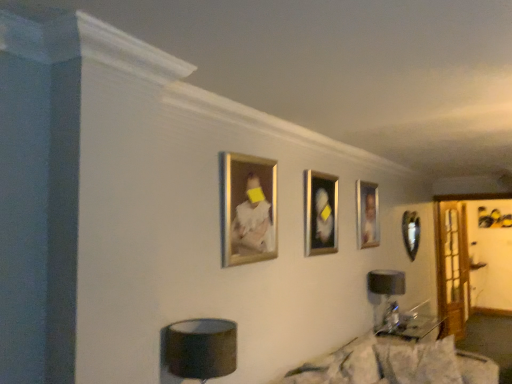
Question: Should I look upward or downward to see fluffy white pillow at lower center, which appears as the first pillow when viewed from the left?

Choices:
 (A) down
 (B) up

Answer: (A)

Question: Does matte black lampshade at lower center, the second table lamp in the back-to-front sequence, have a greater width compared to black fabric table lamp at lower right, the 2th table lamp when ordered from left to right?

Choices:
 (A) no
 (B) yes

Answer: (B)

Question: From the image's perspective, does matte black lampshade at lower center, the 1th table lamp positioned from the front, appear lower than black fabric table lamp at lower right, which is the 1th table lamp from back to front?

Choices:
 (A) yes
 (B) no

Answer: (B)

Question: Is matte black lampshade at lower center, which is counted as the second table lamp, starting from the right, looking in the opposite direction of black fabric table lamp at lower right, which ranks as the first table lamp in right-to-left order?

Choices:
 (A) no
 (B) yes

Answer: (A)

Question: From a real-world perspective, is matte black lampshade at lower center, the 1th table lamp positioned from the front, located beneath black fabric table lamp at lower right, marked as the 2th table lamp in a front-to-back arrangement?

Choices:
 (A) yes
 (B) no

Answer: (B)

Question: Is matte black lampshade at lower center, the second table lamp in the back-to-front sequence, positioned before black fabric table lamp at lower right, marked as the 2th table lamp in a front-to-back arrangement?

Choices:
 (A) yes
 (B) no

Answer: (A)

Question: Can you confirm if matte black lampshade at lower center, the second table lamp in the back-to-front sequence, is smaller than black fabric table lamp at lower right, marked as the 2th table lamp in a front-to-back arrangement?

Choices:
 (A) yes
 (B) no

Answer: (A)

Question: Does metallic silver picture frame at center, positioned as the 3th picture frame in right-to-left order, have a larger size compared to fluffy white pillow at lower center, which appears as the first pillow when viewed from the left?

Choices:
 (A) no
 (B) yes

Answer: (A)

Question: Can we say metallic silver picture frame at center, positioned as the 3th picture frame in right-to-left order, lies outside fluffy white pillow at lower center, the 2th pillow viewed from the right?

Choices:
 (A) no
 (B) yes

Answer: (B)

Question: Can you confirm if metallic silver picture frame at center, which appears as the second picture frame when viewed from the front, is smaller than fluffy white pillow at lower center, which appears as the first pillow when viewed from the left?

Choices:
 (A) yes
 (B) no

Answer: (A)

Question: From a real-world perspective, is metallic silver picture frame at center, which is counted as the 2th picture frame, starting from the left, physically below fluffy white pillow at lower center, the 2th pillow viewed from the right?

Choices:
 (A) no
 (B) yes

Answer: (A)

Question: Is metallic silver picture frame at center, marked as the 3th picture frame in a back-to-front arrangement, further to the viewer compared to fluffy white pillow at lower center, the 2th pillow viewed from the right?

Choices:
 (A) no
 (B) yes

Answer: (B)

Question: Considering the relative sizes of metallic silver picture frame at center, positioned as the 3th picture frame in right-to-left order, and fluffy white pillow at lower center, which appears as the first pillow when viewed from the left, in the image provided, is metallic silver picture frame at center, positioned as the 3th picture frame in right-to-left order, thinner than fluffy white pillow at lower center, which appears as the first pillow when viewed from the left,?

Choices:
 (A) yes
 (B) no

Answer: (A)

Question: Is black fabric table lamp at lower right, which is the 1th table lamp from back to front, outside of gold metallic picture frame at upper center, placed as the first picture frame when sorted from front to back?

Choices:
 (A) no
 (B) yes

Answer: (B)